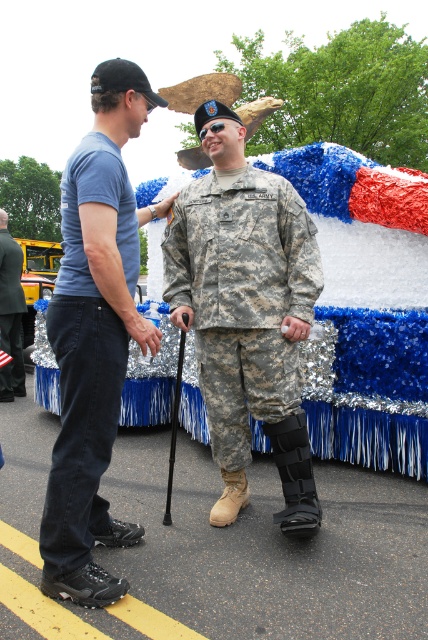
Question: Among these points, which one is nearest to the camera?

Choices:
 (A) (17, 301)
 (B) (125, 173)
 (C) (166, 228)

Answer: (B)

Question: From the image, what is the correct spatial relationship of blue denim jeans at left in relation to brushed metal cane at left?

Choices:
 (A) below
 (B) above

Answer: (A)

Question: Which object is positioned farthest from the camouflage fabric uniform at center?

Choices:
 (A) blue denim jeans at left
 (B) brushed metal cane at left

Answer: (B)

Question: Which of the following is the closest to the observer?

Choices:
 (A) brushed metal cane at left
 (B) blue denim jeans at left

Answer: (B)

Question: Is camouflage fabric uniform at center above blue denim jeans at left?

Choices:
 (A) yes
 (B) no

Answer: (A)

Question: Can you confirm if blue denim jeans at left is positioned to the right of brushed metal cane at left?

Choices:
 (A) yes
 (B) no

Answer: (A)